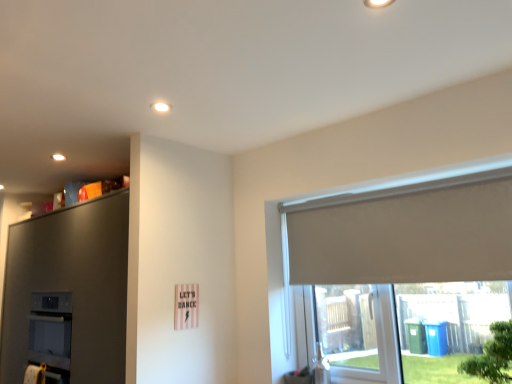
Question: Is green leafy tree at lower right next to matte gray dresser at upper left?

Choices:
 (A) no
 (B) yes

Answer: (A)

Question: Does green leafy tree at lower right turn towards matte gray dresser at upper left?

Choices:
 (A) yes
 (B) no

Answer: (B)

Question: From the image's perspective, is green leafy tree at lower right below matte gray dresser at upper left?

Choices:
 (A) no
 (B) yes

Answer: (A)

Question: Considering the relative positions of green leafy tree at lower right and matte gray dresser at upper left in the image provided, is green leafy tree at lower right to the right of matte gray dresser at upper left from the viewer's perspective?

Choices:
 (A) no
 (B) yes

Answer: (B)

Question: From the image's perspective, is green leafy tree at lower right over matte gray dresser at upper left?

Choices:
 (A) yes
 (B) no

Answer: (A)

Question: Can you confirm if green leafy tree at lower right is thinner than matte gray dresser at upper left?

Choices:
 (A) no
 (B) yes

Answer: (B)

Question: Is matte gray dresser at upper left thinner than white roller blind at right?

Choices:
 (A) no
 (B) yes

Answer: (A)

Question: Is matte gray dresser at upper left oriented towards white roller blind at right?

Choices:
 (A) no
 (B) yes

Answer: (A)

Question: Would you consider matte gray dresser at upper left to be distant from white roller blind at right?

Choices:
 (A) yes
 (B) no

Answer: (A)

Question: Does matte gray dresser at upper left have a greater height compared to white roller blind at right?

Choices:
 (A) no
 (B) yes

Answer: (B)

Question: From the image's perspective, is matte gray dresser at upper left on top of white roller blind at right?

Choices:
 (A) no
 (B) yes

Answer: (A)

Question: Is matte gray dresser at upper left located outside white roller blind at right?

Choices:
 (A) no
 (B) yes

Answer: (B)

Question: Is green leafy tree at lower right far away from white roller blind at right?

Choices:
 (A) no
 (B) yes

Answer: (A)